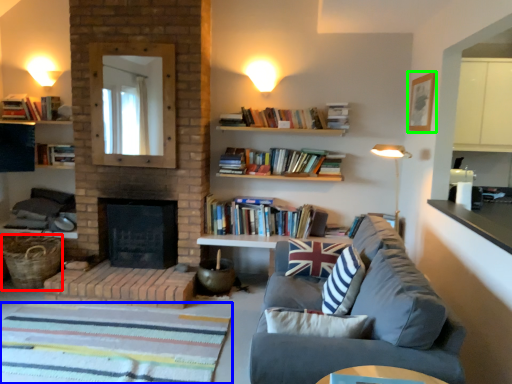
Question: Based on their relative distances, which object is nearer to basket (highlighted by a red box)? Choose from flat (highlighted by a blue box) and picture frame (highlighted by a green box).

Choices:
 (A) flat
 (B) picture frame

Answer: (A)